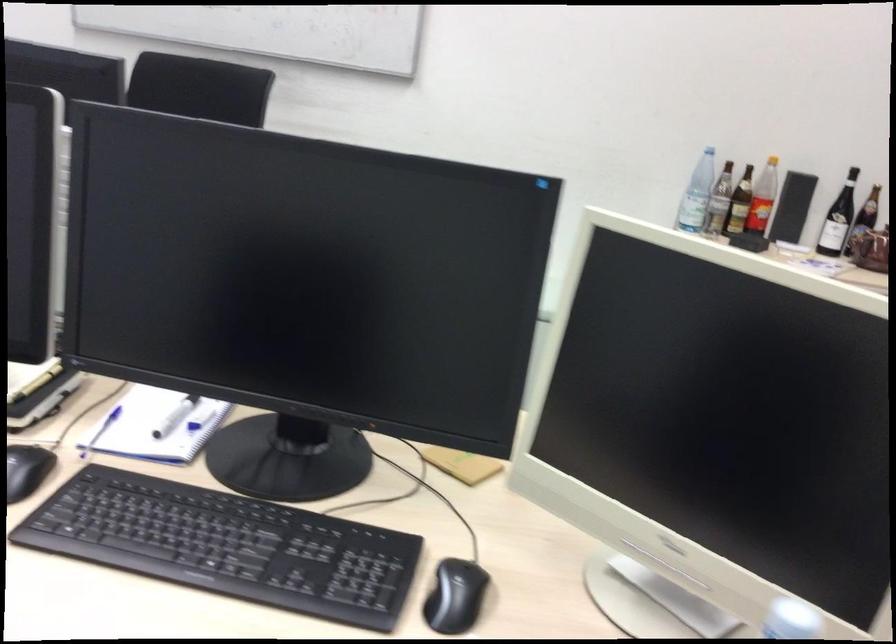
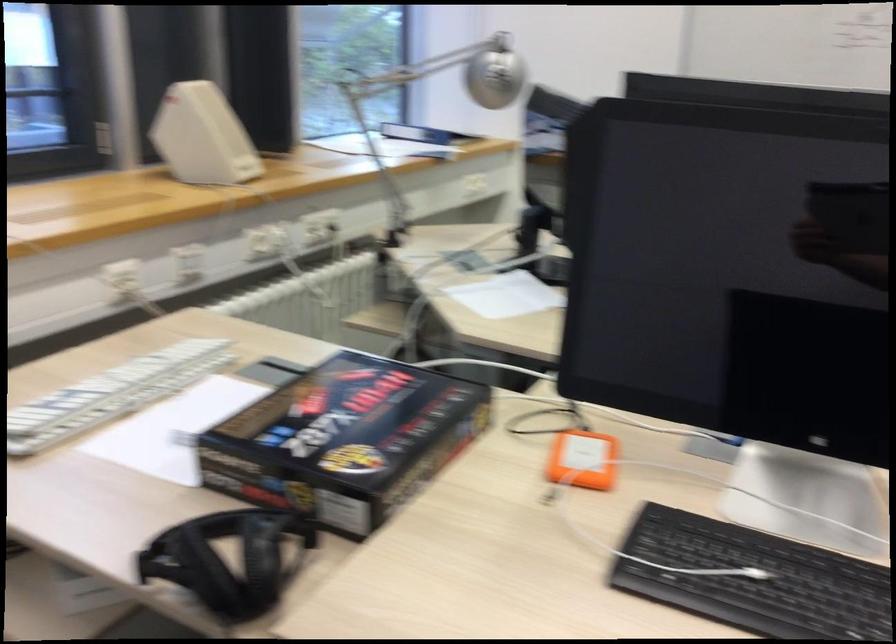
Question: What movement of the cameraman would produce the second image?

Choices:
 (A) Left
 (B) Right
 (C) Forward
 (D) Backward

Answer: (A)